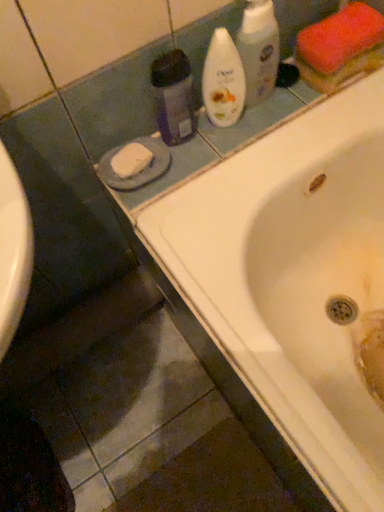
Identify the location of vacant area located to the right-hand side of translucent purple bottle at upper center, acting as the third cleaning product starting from the right. This screenshot has width=384, height=512. (245, 132).